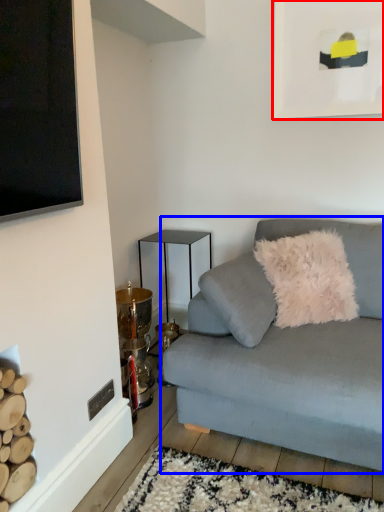
Question: Which object is further to the camera taking this photo, picture frame (highlighted by a red box) or studio couch (highlighted by a blue box)?

Choices:
 (A) picture frame
 (B) studio couch

Answer: (A)